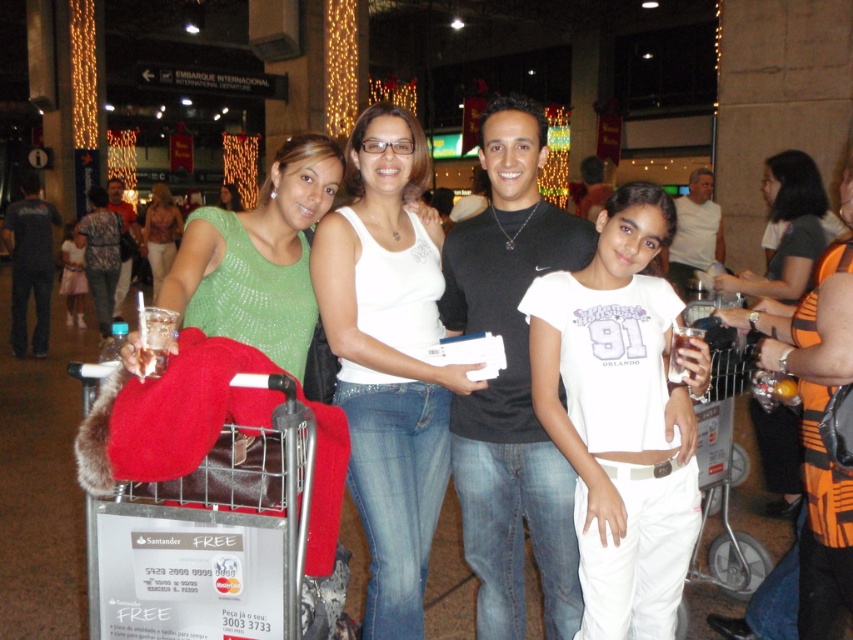
Consider the image. You are taking a photo of the group and want to focus on the two points in the image, point 1 at coordinates point (169, 516) and point 2 at coordinates point (751, 420). Which point should you focus on first to ensure the subject closest to the camera is in focus?

Point 1 at coordinates point (169, 516) is closer to the camera, so focusing on it first will ensure the subject closest to the camera is in focus.

You are a photographer trying to capture a group photo of the white cotton shirt at center and the metallic silver shopping cart at lower left. Which object should you focus on first if you want to ensure both are in frame without moving the camera?

You should focus on the metallic silver shopping cart at lower left first because it is larger than the white cotton shirt at center, ensuring it fits within the frame before adjusting for the smaller object.